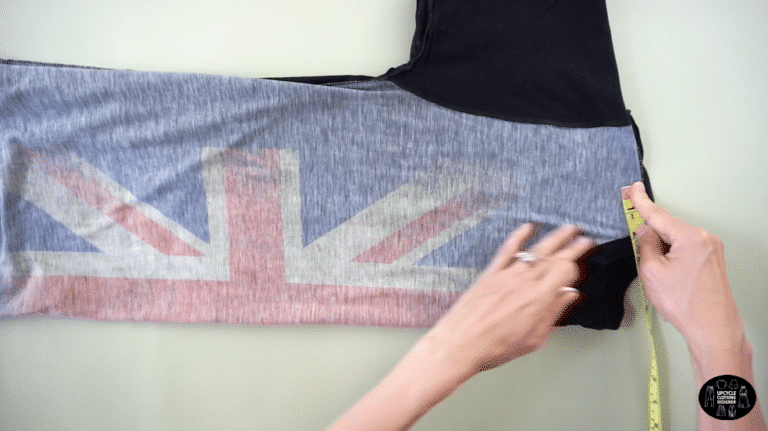
I want to click on table, so tap(220, 379).